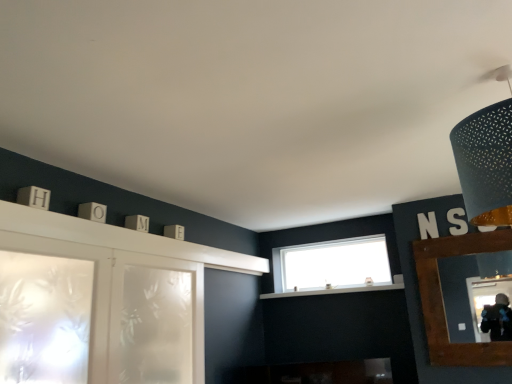
Question: Is point (159, 336) positioned closer to the camera than point (465, 145)?

Choices:
 (A) closer
 (B) farther

Answer: (B)

Question: From a real-world perspective, relative to matte black lampshade at upper right, is frosted glass screen door at lower left vertically above or below?

Choices:
 (A) below
 (B) above

Answer: (A)

Question: Estimate the real-world distances between objects in this image. Which object is closer to the clear glass window at center?

Choices:
 (A) white glossy mantle at center
 (B) matte black lampshade at upper right
 (C) brown wooden mirror at right
 (D) frosted glass screen door at lower left

Answer: (A)

Question: Based on their relative distances, which object is farther from the white glossy mantle at center?

Choices:
 (A) brown wooden mirror at right
 (B) clear glass window at center
 (C) matte black lampshade at upper right
 (D) frosted glass screen door at lower left

Answer: (C)